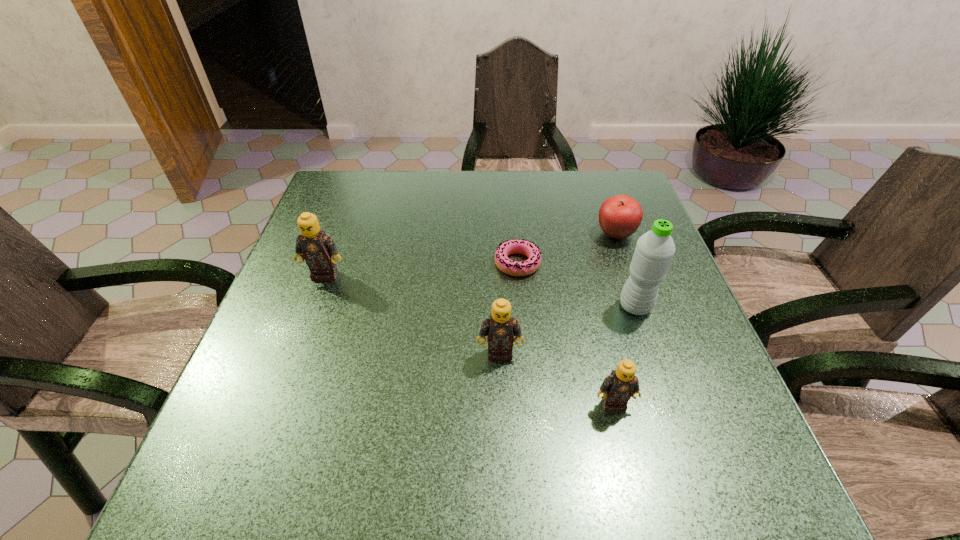
Find the location of a particular element. free space located 0.060m in front of the farthest Lego is located at coordinates (316, 300).

The width and height of the screenshot is (960, 540). In order to click on vacant space located in front of the second nearest Lego in this screenshot , I will do `click(501, 392)`.

You are a GUI agent. You are given a task and a screenshot of the screen. Output one action in this format:
    pyautogui.click(x=<x>, y=<y>)
    Task: Click on the vacant region located on the front of the farthest object
    
    Given the screenshot: What is the action you would take?
    pyautogui.click(x=632, y=280)

What are the coordinates of `vacant space located on the back of the doughnut` in the screenshot? It's located at (x=513, y=213).

Where is `free space located on the left of the fourth farthest object`? The width and height of the screenshot is (960, 540). free space located on the left of the fourth farthest object is located at coordinates (478, 307).

At what (x,y) coordinates should I click in order to perform the action: click on object that is at the near edge. Please return your answer as a coordinate pair (x, y). Looking at the image, I should click on (622, 384).

Locate an element on the screen. This screenshot has height=540, width=960. object that is at the left edge is located at coordinates (318, 249).

Image resolution: width=960 pixels, height=540 pixels. Identify the location of apple that is at the right edge. (620, 216).

At what (x,y) coordinates should I click in order to perform the action: click on water bottle that is at the right edge. Please return your answer as a coordinate pair (x, y). The height and width of the screenshot is (540, 960). Looking at the image, I should click on (654, 251).

Locate an element on the screen. The image size is (960, 540). vacant area at the far edge of the desktop is located at coordinates (498, 194).